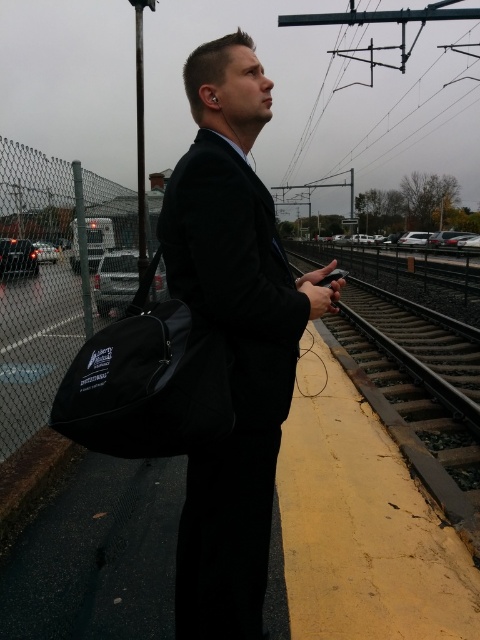
Question: Based on their relative distances, which object is farther from the black fabric bag at left?

Choices:
 (A) metal train track at center
 (B) matte black suit at center

Answer: (A)

Question: Can you confirm if matte black suit at center is positioned to the left of black fabric bag at left?

Choices:
 (A) yes
 (B) no

Answer: (B)

Question: Based on their relative distances, which object is farther from the metal train track at center?

Choices:
 (A) matte black suit at center
 (B) black fabric bag at left

Answer: (B)

Question: Is matte black suit at center above metal train track at center?

Choices:
 (A) yes
 (B) no

Answer: (A)

Question: Considering the real-world distances, which object is closest to the metal train track at center?

Choices:
 (A) matte black suit at center
 (B) black fabric bag at left

Answer: (A)

Question: Can you confirm if black fabric bag at left is wider than metal train track at center?

Choices:
 (A) no
 (B) yes

Answer: (A)